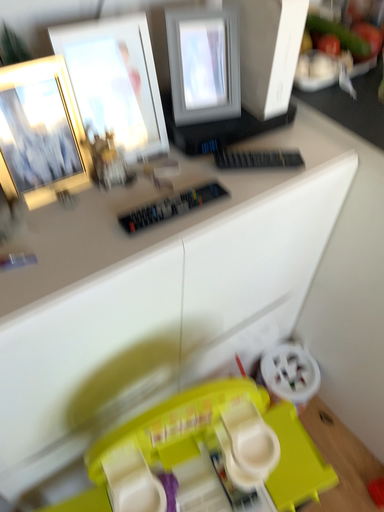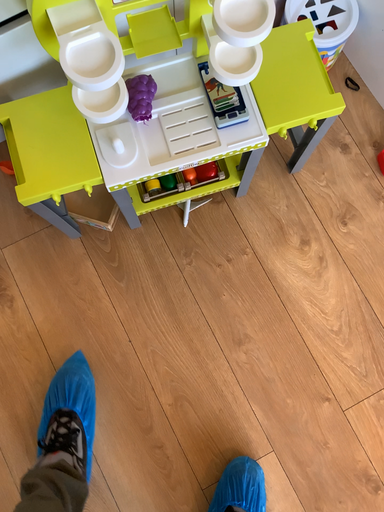
Question: How did the camera likely rotate when shooting the video?

Choices:
 (A) rotated right
 (B) rotated left

Answer: (B)